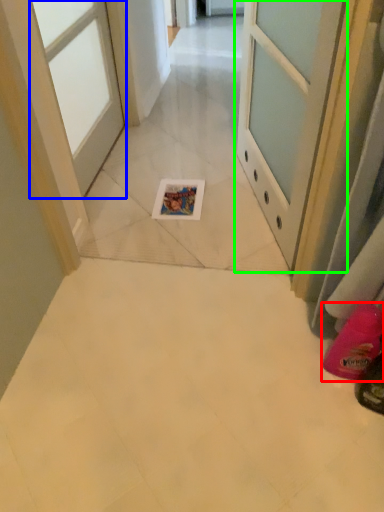
Question: Considering the real-world distances, which object is farthest from footwear (highlighted by a red box)? door (highlighted by a blue box) or door (highlighted by a green box)?

Choices:
 (A) door
 (B) door

Answer: (A)